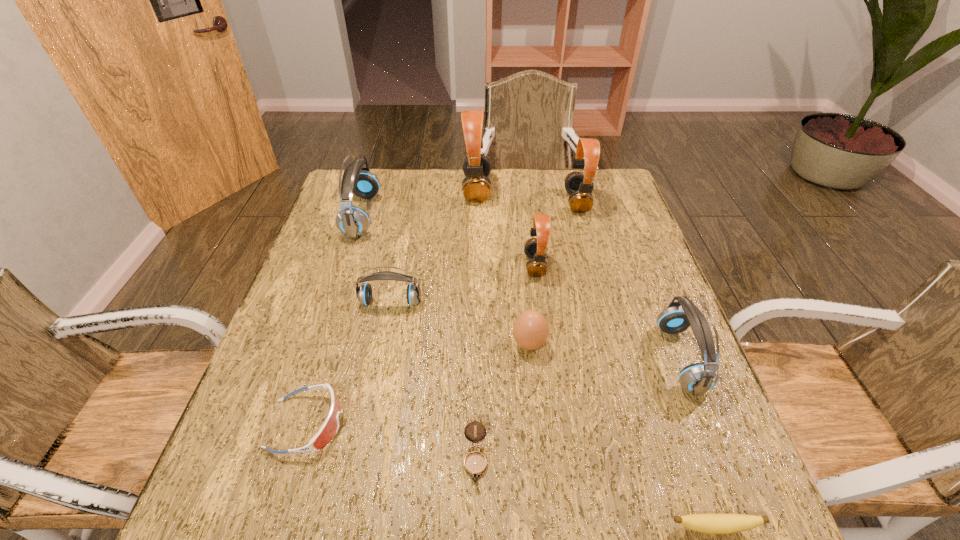
Identify the location of free space at the far edge of the desktop. This screenshot has height=540, width=960. (391, 207).

Where is `free space at the near edge of the desktop`? Image resolution: width=960 pixels, height=540 pixels. free space at the near edge of the desktop is located at coordinates tap(483, 507).

This screenshot has height=540, width=960. In the image, there is a desktop. Identify the location of vacant space at the left edge. (249, 450).

In order to click on vacant space at the right edge in this screenshot , I will do `click(647, 245)`.

Where is `vacant space at the far left corner of the desktop`? The image size is (960, 540). vacant space at the far left corner of the desktop is located at coordinates (382, 189).

The height and width of the screenshot is (540, 960). Identify the location of vacant space at the far right corner. (599, 176).

This screenshot has height=540, width=960. I want to click on vacant space that is in between the leftmost blue headset and the fifth headset from left to right, so [x=469, y=208].

This screenshot has width=960, height=540. Find the location of `free space between the goggles and the tallest headset`. free space between the goggles and the tallest headset is located at coordinates (392, 306).

At what (x,y) coordinates should I click in order to perform the action: click on free spot between the brown boiled egg and the second biggest blue headset. Please return your answer as a coordinate pair (x, y). The image size is (960, 540). Looking at the image, I should click on (605, 351).

Identify the location of free space between the leftmost blue headset and the third headset from right to left. (448, 240).